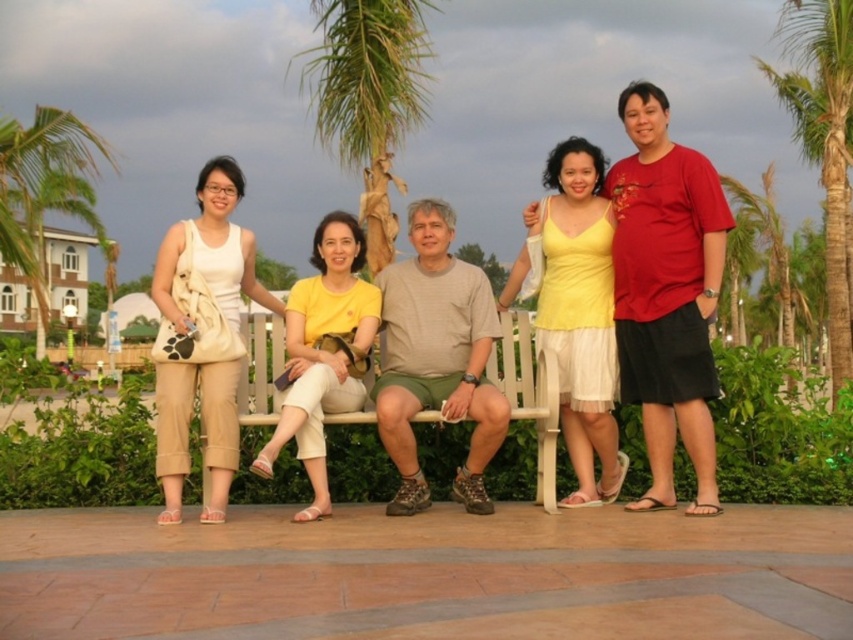
Which is below, beige fabric bag at left or white wooden bench at center?

Positioned lower is white wooden bench at center.

Can you confirm if beige fabric bag at left is positioned above white wooden bench at center?

Yes.

Does point (230, 288) lie in front of point (550, 451)?

No.

Image resolution: width=853 pixels, height=640 pixels. I want to click on beige fabric bag at left, so click(x=202, y=428).

Who is positioned more to the left, beige fabric purse at upper left or green leafy palm tree at upper center?

green leafy palm tree at upper center

Based on the photo, is beige fabric purse at upper left shorter than green leafy palm tree at upper center?

Yes.

The width and height of the screenshot is (853, 640). Describe the element at coordinates (640, 221) in the screenshot. I see `beige fabric purse at upper left` at that location.

I want to click on beige fabric purse at upper left, so click(x=640, y=221).

Can you confirm if yellow matte tank top at center is bigger than green leafy palm tree at upper center?

No, yellow matte tank top at center is not bigger than green leafy palm tree at upper center.

Between point (592, 372) and point (328, 122), which one is positioned behind?

The point (328, 122) is behind.

Who is more forward, (596,449) or (332,109)?

Point (596,449)

Identify the location of yellow matte tank top at center. (576, 310).